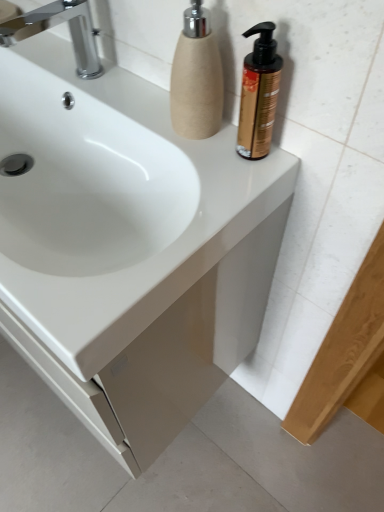
Where is `free spot to the right of chrome metallic faucet at upper left`? The width and height of the screenshot is (384, 512). free spot to the right of chrome metallic faucet at upper left is located at coordinates (130, 88).